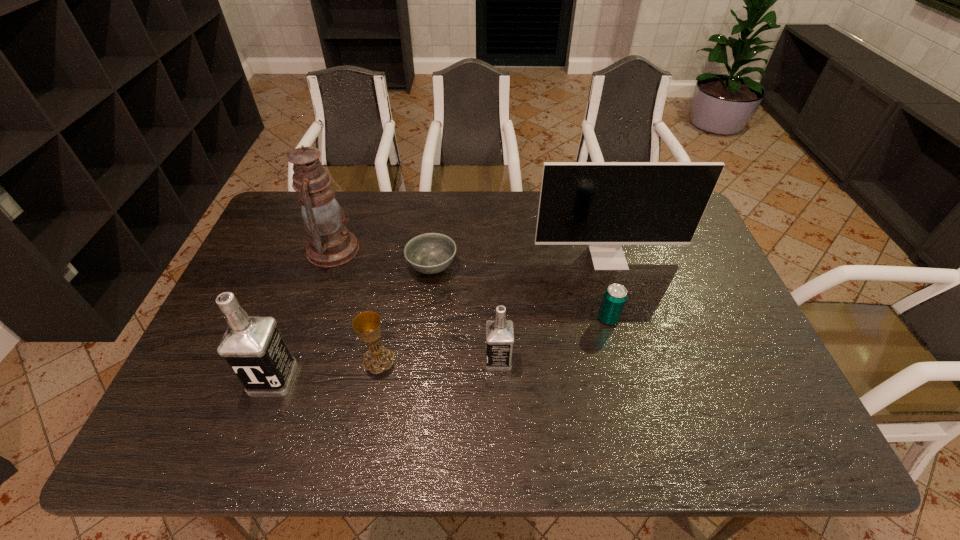
Identify the location of the left vodka. This screenshot has width=960, height=540. (253, 347).

In order to click on the shorter vodka in this screenshot , I will do `click(499, 333)`.

Identify the location of the fifth object from left to right. (499, 333).

I want to click on oil lamp, so click(x=331, y=244).

Where is `monitor`? monitor is located at coordinates (605, 205).

Where is `bowl`? Image resolution: width=960 pixels, height=540 pixels. bowl is located at coordinates (430, 253).

Where is `beer can`? The width and height of the screenshot is (960, 540). beer can is located at coordinates (615, 296).

The height and width of the screenshot is (540, 960). I want to click on the fourth farthest object, so click(x=615, y=296).

Locate an element on the screen. This screenshot has width=960, height=540. chalice is located at coordinates (367, 324).

Locate an element on the screen. Image resolution: width=960 pixels, height=540 pixels. vacant space located 0.300m on the front label of the fifth object from left to right is located at coordinates click(x=367, y=360).